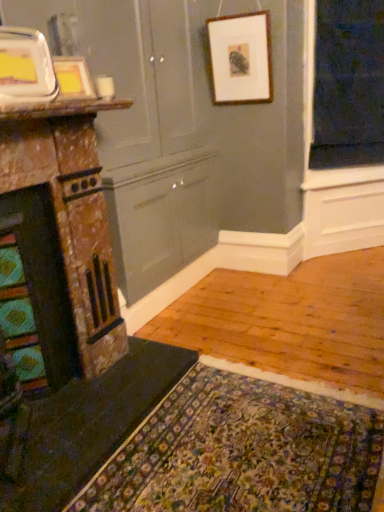
Question: Is dark green felt doormat at lower left looking in the opposite direction of wooden picture frame at upper center, which is the 3th picture frame in bottom-to-top order?

Choices:
 (A) yes
 (B) no

Answer: (B)

Question: Can you confirm if dark green felt doormat at lower left is taller than wooden picture frame at upper center, which ranks as the 1th picture frame in top-to-bottom order?

Choices:
 (A) no
 (B) yes

Answer: (A)

Question: Considering the relative positions of dark green felt doormat at lower left and wooden picture frame at upper center, which is the 3th picture frame in bottom-to-top order, in the image provided, is dark green felt doormat at lower left to the left of wooden picture frame at upper center, which is the 3th picture frame in bottom-to-top order, from the viewer's perspective?

Choices:
 (A) no
 (B) yes

Answer: (B)

Question: Is dark green felt doormat at lower left located outside wooden picture frame at upper center, which ranks as the 1th picture frame in top-to-bottom order?

Choices:
 (A) yes
 (B) no

Answer: (A)

Question: Can you confirm if dark green felt doormat at lower left is shorter than wooden picture frame at upper center, which is the third picture frame in left-to-right order?

Choices:
 (A) yes
 (B) no

Answer: (A)

Question: Considering their positions, is marble fireplace at left located in front of or behind dark green felt doormat at lower left?

Choices:
 (A) front
 (B) behind

Answer: (B)

Question: Choose the correct answer: Is marble fireplace at left inside dark green felt doormat at lower left or outside it?

Choices:
 (A) inside
 (B) outside

Answer: (B)

Question: From a real-world perspective, is marble fireplace at left physically located above or below dark green felt doormat at lower left?

Choices:
 (A) below
 (B) above

Answer: (B)

Question: Looking at the image, does marble fireplace at left seem bigger or smaller compared to dark green felt doormat at lower left?

Choices:
 (A) big
 (B) small

Answer: (A)

Question: Considering the positions of marble fireplace at left and matte white picture frame at upper left, the 3th picture frame viewed from the right, in the image, is marble fireplace at left wider or thinner than matte white picture frame at upper left, the 3th picture frame viewed from the right,?

Choices:
 (A) wide
 (B) thin

Answer: (A)

Question: Is marble fireplace at left taller or shorter than matte white picture frame at upper left, which is the first picture frame from left to right?

Choices:
 (A) short
 (B) tall

Answer: (B)

Question: In the image, is marble fireplace at left on the left side or the right side of matte white picture frame at upper left, which is the 1th picture frame in bottom-to-top order?

Choices:
 (A) left
 (B) right

Answer: (A)

Question: Relative to matte white picture frame at upper left, the third picture frame in the top-to-bottom sequence, is marble fireplace at left in front or behind?

Choices:
 (A) behind
 (B) front

Answer: (B)

Question: Considering the positions of marble fireplace at left and wooden picture frame at upper center, which is the third picture frame in left-to-right order, in the image, is marble fireplace at left bigger or smaller than wooden picture frame at upper center, which is the third picture frame in left-to-right order,?

Choices:
 (A) small
 (B) big

Answer: (B)

Question: Based on their positions, is marble fireplace at left located to the left or right of wooden picture frame at upper center, which is the 3th picture frame in bottom-to-top order?

Choices:
 (A) left
 (B) right

Answer: (A)